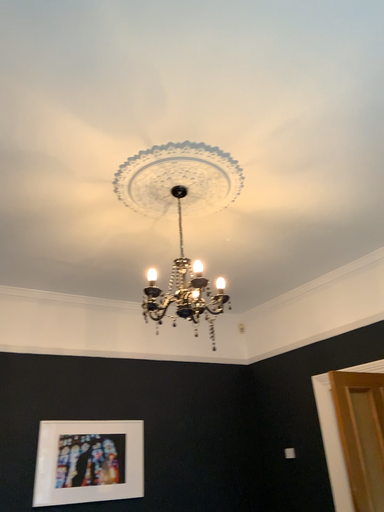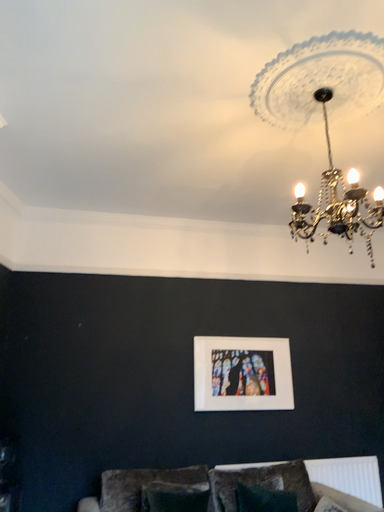
Question: How did the camera likely rotate when shooting the video?

Choices:
 (A) rotated left
 (B) rotated right

Answer: (A)